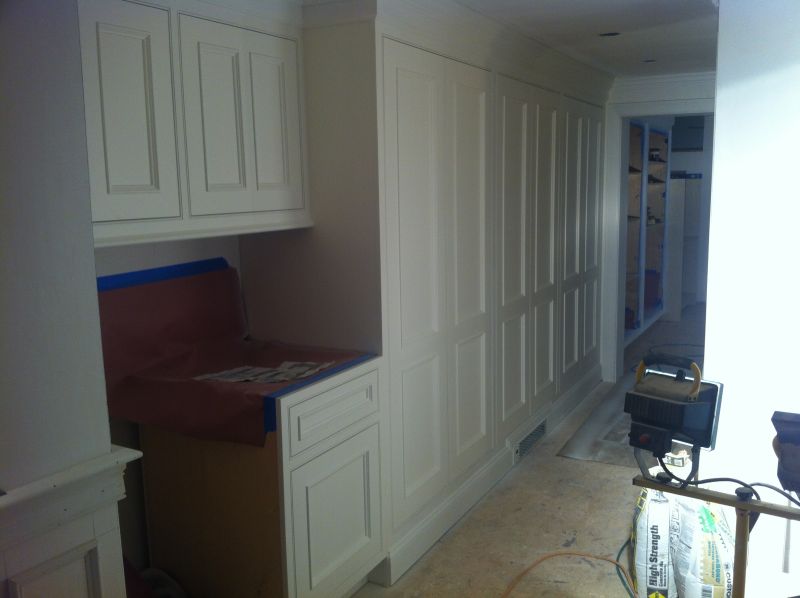
Locate an element on the screen. This screenshot has width=800, height=598. wall is located at coordinates (22, 388).